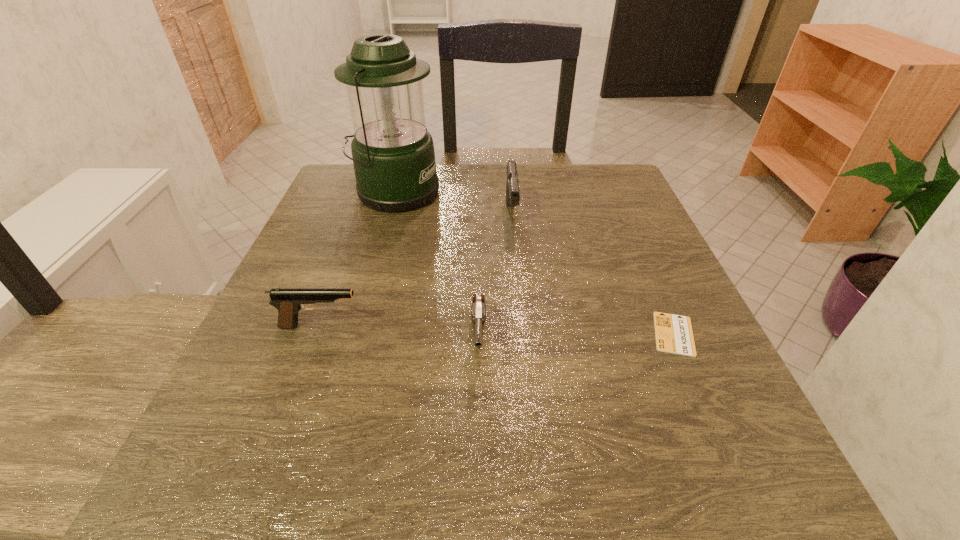
I want to click on empty space that is in between the shortest object and the second pistol from right to left, so click(576, 338).

Where is `vacant space that's between the identity card and the fourth object from left to right`? vacant space that's between the identity card and the fourth object from left to right is located at coordinates (593, 274).

You are a GUI agent. You are given a task and a screenshot of the screen. Output one action in this format:
    pyautogui.click(x=<x>, y=<y>)
    Task: Click on the free point between the second pistol from right to left and the leftmost pistol
    
    Given the screenshot: What is the action you would take?
    pyautogui.click(x=399, y=334)

This screenshot has width=960, height=540. Find the location of `free point between the leftmost pistol and the third object from right to left`. free point between the leftmost pistol and the third object from right to left is located at coordinates (399, 334).

You are a GUI agent. You are given a task and a screenshot of the screen. Output one action in this format:
    pyautogui.click(x=<x>, y=<y>)
    Task: Click on the vacant space that is in between the second pistol from left to right and the fourth object from left to right
    The height and width of the screenshot is (540, 960).
    Given the screenshot: What is the action you would take?
    pyautogui.click(x=495, y=279)

What are the coordinates of `the closest object relative to the rightmost pistol` in the screenshot? It's located at (393, 155).

Choose which object is the second nearest neighbor to the rightmost object. Please provide its 2D coordinates. Your answer should be formatted as a tuple, i.e. [(x, y)], where the tuple contains the x and y coordinates of a point satisfying the conditions above.

[(512, 188)]

Identify which pistol is the nearest to the tallest object. Please provide its 2D coordinates. Your answer should be formatted as a tuple, i.e. [(x, y)], where the tuple contains the x and y coordinates of a point satisfying the conditions above.

[(512, 188)]

The image size is (960, 540). Identify the location of pistol identified as the second closest to the leftmost pistol. (512, 188).

Where is `vacant space that satisfies the following two spatial constraints: 1. on the front side of the tallest object; 2. at the muzzle of the leftmost pistol`? This screenshot has height=540, width=960. vacant space that satisfies the following two spatial constraints: 1. on the front side of the tallest object; 2. at the muzzle of the leftmost pistol is located at coordinates (357, 326).